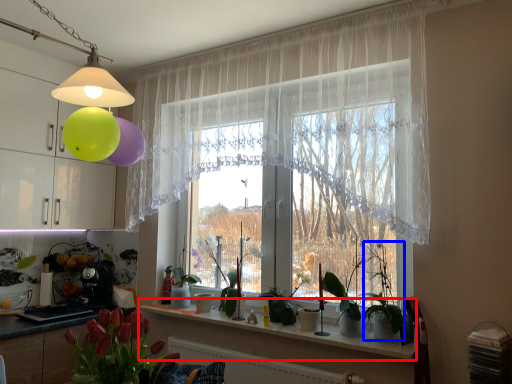
Question: Which object appears farthest to the camera in this image, window sill (highlighted by a red box) or plant (highlighted by a blue box)?

Choices:
 (A) window sill
 (B) plant

Answer: (A)